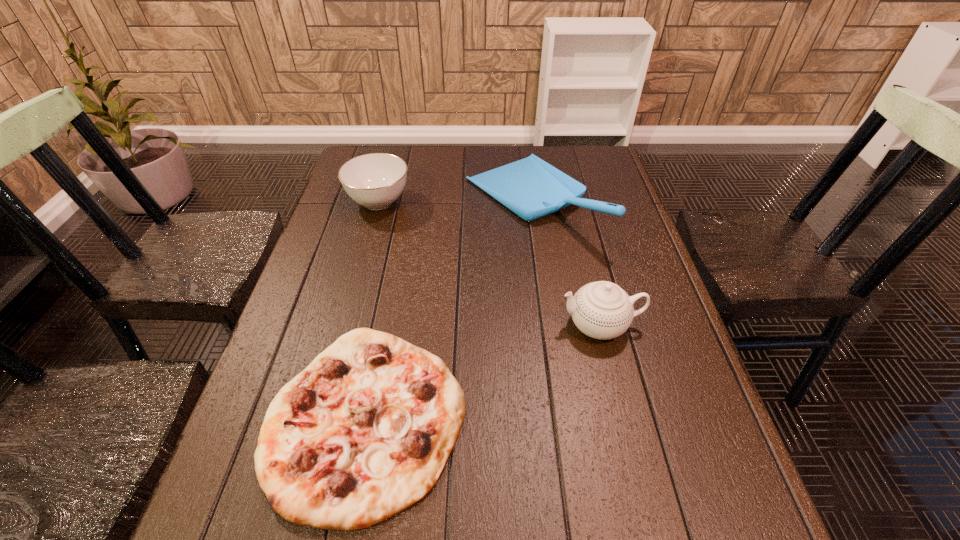
Identify the location of vacant space located 0.180m on the right of the farther chinaware. The image size is (960, 540). tap(470, 201).

The height and width of the screenshot is (540, 960). Identify the location of vacant space located on the back of the shortest object. click(399, 249).

In order to click on dustpan situated at the far edge in this screenshot , I will do `click(532, 188)`.

Where is `chinaware present at the far edge`? This screenshot has width=960, height=540. chinaware present at the far edge is located at coordinates (376, 180).

The image size is (960, 540). I want to click on object positioned at the near edge, so click(x=364, y=432).

The height and width of the screenshot is (540, 960). What are the coordinates of `chinaware positioned at the left edge` in the screenshot? It's located at (376, 180).

Image resolution: width=960 pixels, height=540 pixels. Identify the location of pizza that is at the left edge. (364, 432).

Where is `dustpan that is at the right edge`? The image size is (960, 540). dustpan that is at the right edge is located at coordinates (532, 188).

Identify the location of chinaware located in the right edge section of the desktop. The height and width of the screenshot is (540, 960). (602, 310).

The image size is (960, 540). Find the location of `object at the far left corner`. object at the far left corner is located at coordinates (376, 180).